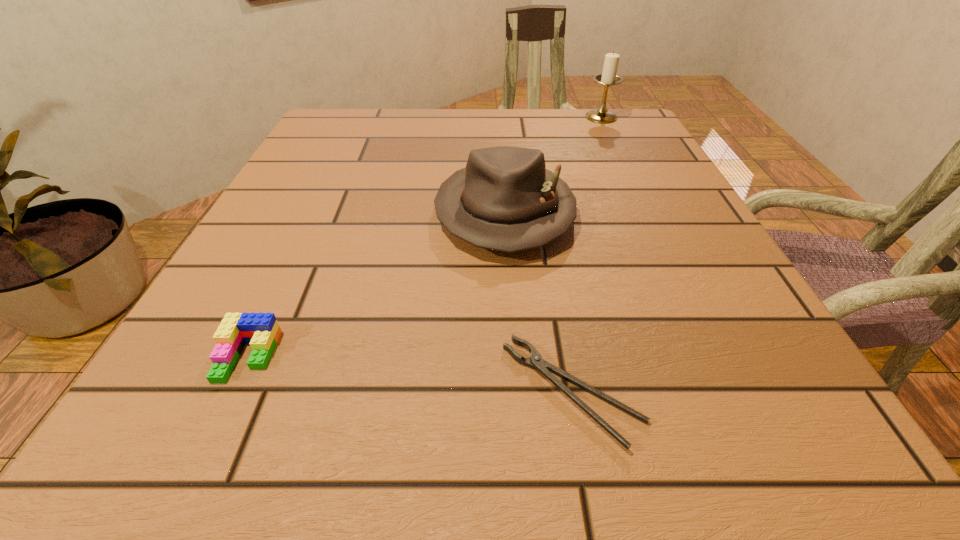
Locate an element on the screen. The width and height of the screenshot is (960, 540). candle holder is located at coordinates (608, 77).

Image resolution: width=960 pixels, height=540 pixels. I want to click on the tallest object, so click(608, 77).

The image size is (960, 540). I want to click on hat, so click(x=505, y=199).

Image resolution: width=960 pixels, height=540 pixels. Identify the location of the second farthest object. (505, 199).

Where is `Lego`? This screenshot has width=960, height=540. Lego is located at coordinates (261, 330).

The width and height of the screenshot is (960, 540). Identify the location of the second shortest object. point(261,330).

You are a GUI agent. You are given a task and a screenshot of the screen. Output one action in this format:
    pyautogui.click(x=<x>, y=<y>)
    Task: Click on the shortest object
    The height and width of the screenshot is (540, 960).
    Given the screenshot: What is the action you would take?
    pyautogui.click(x=535, y=361)

Where is `free space located on the front of the rightmost object`? free space located on the front of the rightmost object is located at coordinates [620, 157].

Where is `blank area located 0.150m on the decorative side of the third nearest object`? Image resolution: width=960 pixels, height=540 pixels. blank area located 0.150m on the decorative side of the third nearest object is located at coordinates (514, 340).

The width and height of the screenshot is (960, 540). I want to click on free spot located 0.210m on the right of the second shortest object, so click(x=433, y=356).